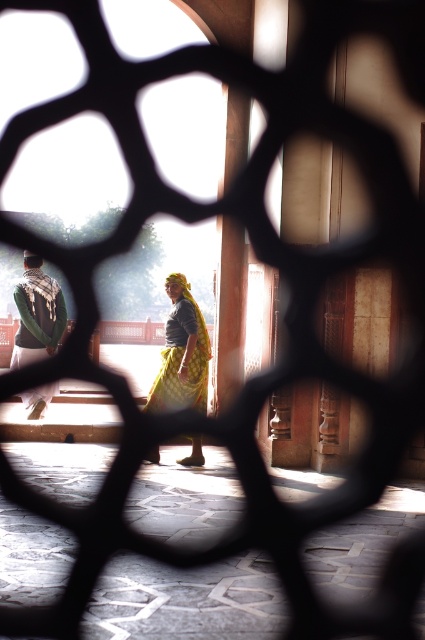
You are an interior designer trying to place a decorative item between the yellow fabric skirt at center and the green fabric shawl at left. Based on their widths, which object should you place the item closer to to ensure it fits better?

The yellow fabric skirt at center might be wider than green fabric shawl at left, so placing the decorative item closer to the yellow fabric skirt at center would provide more space for it to fit comfortably.

You are standing in a room with a lattice window. You see a point at coordinates (x=181, y=353). What object is located at that point?

The point at coordinates (x=181, y=353) indicates the yellow fabric skirt at center.